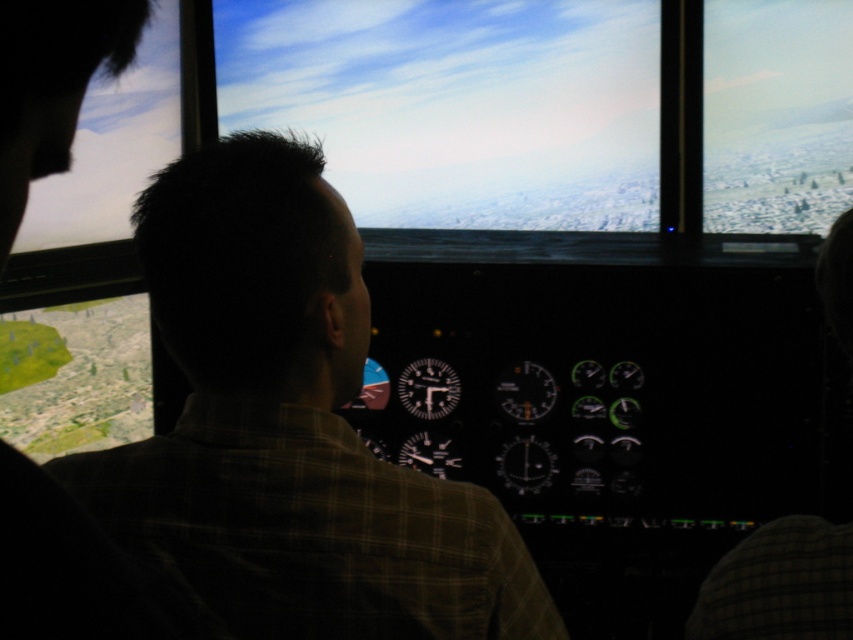
From the picture: You are standing in front of the flight simulator and notice the brown plaid shirt at center and the cloudy sky at center. Which object is positioned to the left when viewed from your perspective?

The brown plaid shirt at center is to the left of the cloudy sky at center from your viewpoint.

You are an aviation technician inspecting the flight simulator. You notice the brown plaid shirt at center and the cloudy sky at center. Which object is wider?

The cloudy sky at center is wider than the brown plaid shirt at center because the brown plaid shirt at center has a smaller width compared to the cloudy sky at center.

You are a flight instructor observing a trainee in the flight simulator. The trainee is wearing a brown plaid shirt at center. You need to hand them a checklist that is 12 inches long. Is the distance between you and the trainee sufficient to safely pass the checklist without it touching any instruments on the dashboard?

The distance between you and the trainee wearing the brown plaid shirt at center is 33.56 inches. Since the checklist is only 12 inches long, there is ample space to safely pass it without it touching any instruments on the dashboard.